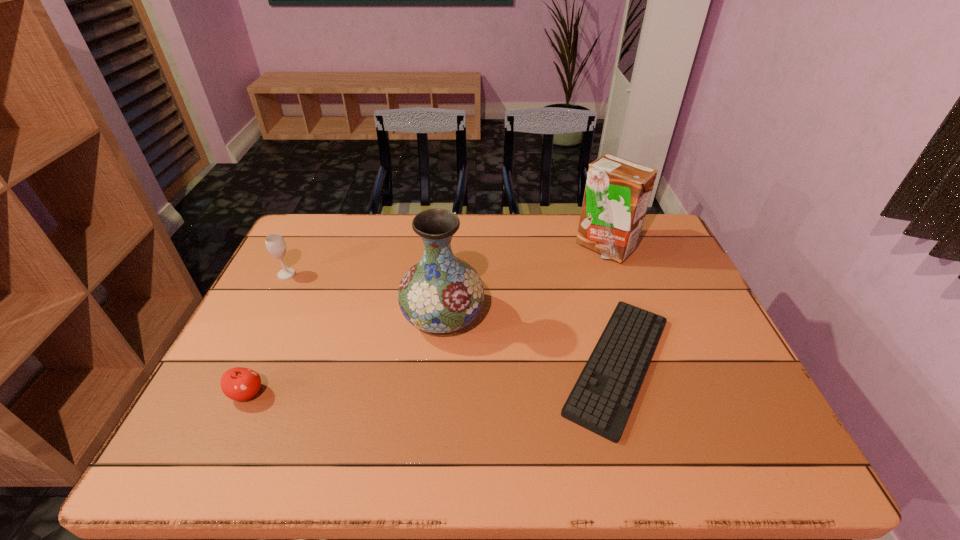
Find the location of `vacant space at the left edge of the desktop`. vacant space at the left edge of the desktop is located at coordinates (252, 327).

Where is `vacant region at the right edge of the desktop`? The height and width of the screenshot is (540, 960). vacant region at the right edge of the desktop is located at coordinates (691, 363).

Locate an element on the screen. free region at the far left corner is located at coordinates (294, 249).

Where is `vacant space at the near right corner of the desktop`? The height and width of the screenshot is (540, 960). vacant space at the near right corner of the desktop is located at coordinates (764, 465).

Locate an element on the screen. Image resolution: width=960 pixels, height=540 pixels. free space between the shortest object and the farthest object is located at coordinates (611, 306).

You are a GUI agent. You are given a task and a screenshot of the screen. Output one action in this format:
    pyautogui.click(x=<x>, y=<y>)
    Task: Click on the free space between the third object from right to left and the fourth tallest object
    The image size is (960, 540).
    Given the screenshot: What is the action you would take?
    pos(345,355)

Find the location of a particular element. This screenshot has height=540, width=960. vacant area that lies between the fourth tallest object and the third object from right to left is located at coordinates (345, 355).

This screenshot has width=960, height=540. I want to click on blank region between the carton and the third object from left to right, so click(523, 282).

Locate an element on the screen. The image size is (960, 540). vacant region between the second shortest object and the fourth nearest object is located at coordinates (267, 334).

Where is `vacant region between the apple and the third object from left to right`? This screenshot has height=540, width=960. vacant region between the apple and the third object from left to right is located at coordinates coord(345,355).